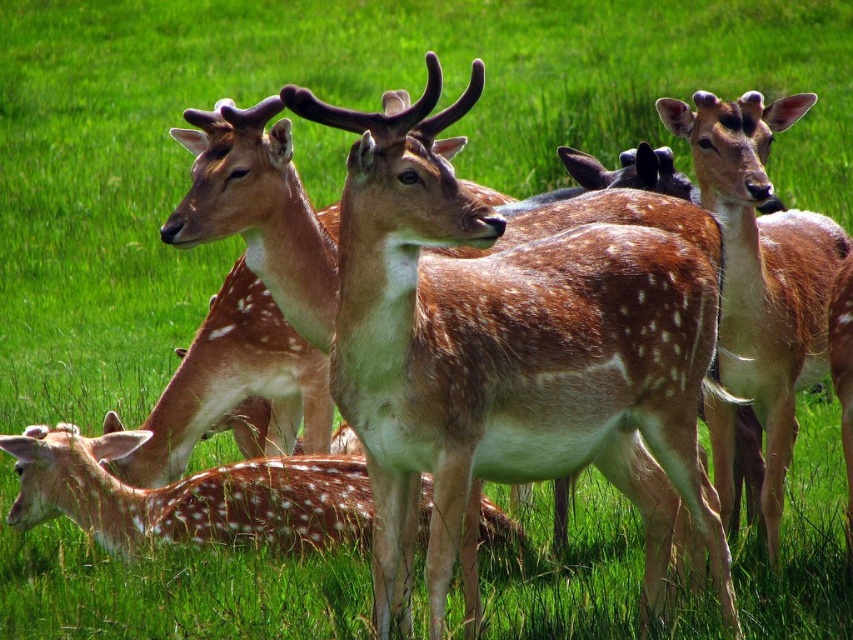
Who is more forward, (x=430, y=332) or (x=224, y=508)?

Point (x=430, y=332) is more forward.

Is point (418, 396) behind point (514, 531)?

No, it is in front of (514, 531).

At what (x,y) coordinates should I click in order to perform the action: click on brown speckled fur at center. Please return your answer as a coordinate pair (x, y). This screenshot has width=853, height=640. Looking at the image, I should click on (505, 353).

Can you confirm if brown spotted fur at center is positioned to the right of spotted fur deer at center?

Correct, you'll find brown spotted fur at center to the right of spotted fur deer at center.

Who is higher up, brown spotted fur at center or spotted fur deer at center?

brown spotted fur at center

Is point (737, 280) closer to viewer compared to point (218, 497)?

Yes, point (737, 280) is in front of point (218, 497).

This screenshot has height=640, width=853. What are the coordinates of `brown spotted fur at center` in the screenshot? It's located at (762, 269).

Is brown speckled fur at center further to camera compared to brown spotted fur at center?

No, brown speckled fur at center is in front of brown spotted fur at center.

Is point (451, 272) closer to viewer compared to point (729, 346)?

Yes, it is in front of point (729, 346).

Where is `brown speckled fur at center`? The width and height of the screenshot is (853, 640). brown speckled fur at center is located at coordinates (505, 353).